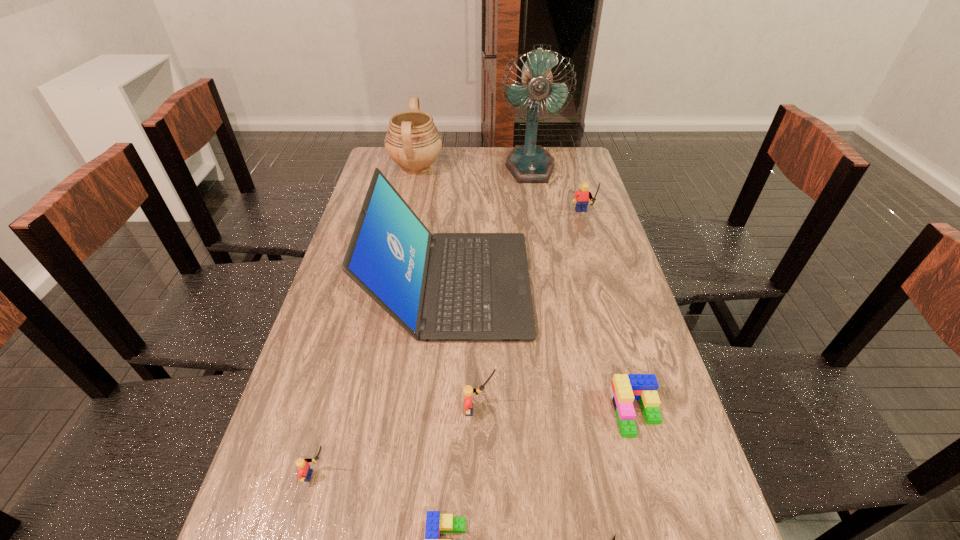
In order to click on the tallest object in this screenshot , I will do `click(530, 163)`.

The height and width of the screenshot is (540, 960). What are the coordinates of `blue fan` in the screenshot? It's located at (530, 163).

At what (x,y) coordinates should I click in order to perform the action: click on laptop computer. Please return your answer as a coordinate pair (x, y). Looking at the image, I should click on (447, 287).

Where is `gray laptop computer`? This screenshot has height=540, width=960. gray laptop computer is located at coordinates (447, 287).

This screenshot has width=960, height=540. I want to click on urn, so click(413, 142).

Find the location of `the farthest yellow Lego`. the farthest yellow Lego is located at coordinates (581, 198).

At what (x,y) coordinates should I click in order to perform the action: click on the farthest Lego. Please return your answer as a coordinate pair (x, y). Looking at the image, I should click on (581, 198).

Locate an element on the screen. The width and height of the screenshot is (960, 540). the second biggest yellow Lego is located at coordinates (468, 391).

You are a GUI agent. You are given a task and a screenshot of the screen. Output one action in this format:
    pyautogui.click(x=<x>, y=<y>)
    Task: Click on the fourth shortest Lego
    
    Given the screenshot: What is the action you would take?
    pyautogui.click(x=468, y=391)

The height and width of the screenshot is (540, 960). What are the coordinates of `the smallest yellow Lego` in the screenshot? It's located at (304, 473).